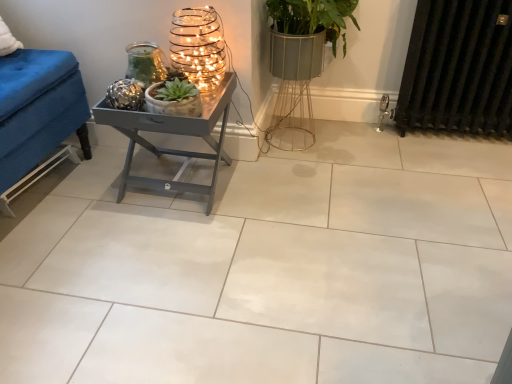
In order to click on vacant region to the right of metallic gray table at center in this screenshot , I will do `click(270, 187)`.